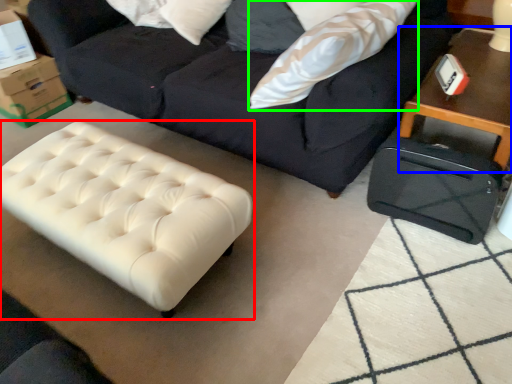
Question: Estimate the real-world distances between objects in this image. Which object is farther from table (highlighted by a red box), table (highlighted by a blue box) or throw pillow (highlighted by a green box)?

Choices:
 (A) table
 (B) throw pillow

Answer: (A)